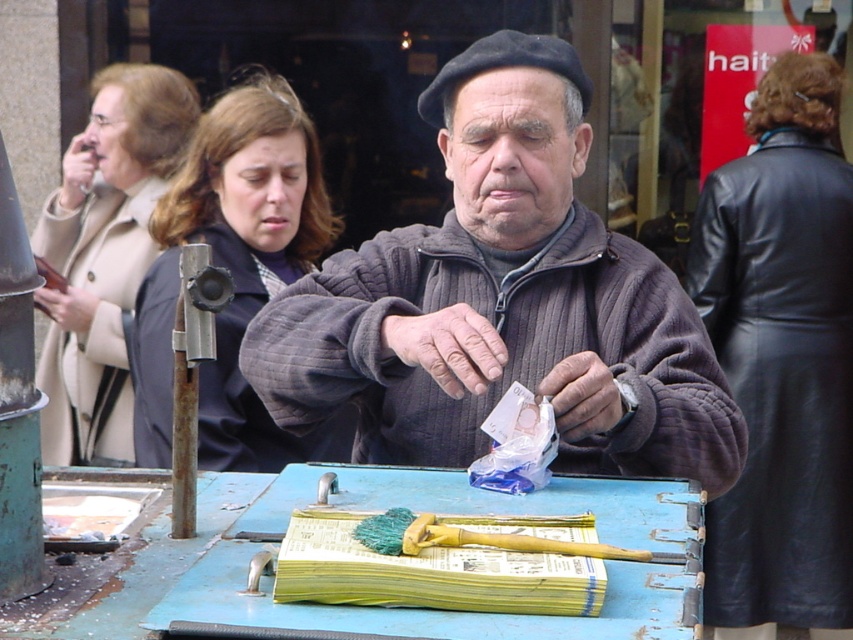
You are a tailor who needs to determine if the dark gray sweater at center can be folded and placed on the blue painted wood table at center. Based on their sizes, can the sweater fit on the table?

The dark gray sweater at center is bigger than the blue painted wood table at center, so it cannot be folded to fit on the table without overlapping the edges.